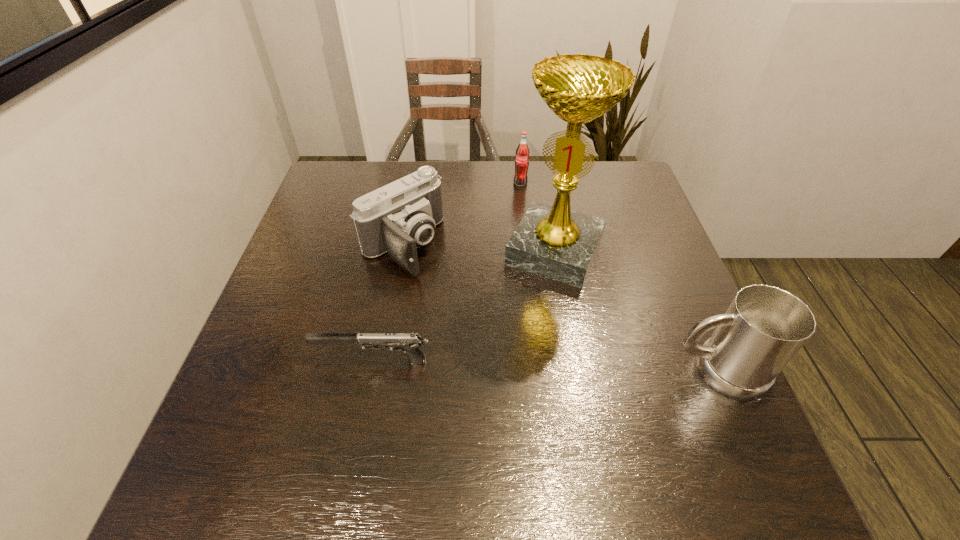
The width and height of the screenshot is (960, 540). In order to click on the shortest object in this screenshot , I will do `click(409, 343)`.

The width and height of the screenshot is (960, 540). What are the coordinates of `mug` in the screenshot? It's located at (764, 327).

You are a GUI agent. You are given a task and a screenshot of the screen. Output one action in this format:
    pyautogui.click(x=<x>, y=<y>)
    Task: Click on the farthest object
    Image resolution: width=960 pixels, height=540 pixels.
    Given the screenshot: What is the action you would take?
    pyautogui.click(x=522, y=152)

At what (x,y) coordinates should I click in order to perform the action: click on camera. Please return your answer as a coordinate pair (x, y). This screenshot has height=540, width=960. Looking at the image, I should click on (398, 218).

The width and height of the screenshot is (960, 540). I want to click on award, so click(554, 242).

Where is `free spot located at the muzzle end of the gun`? This screenshot has height=540, width=960. free spot located at the muzzle end of the gun is located at coordinates tap(268, 361).

I want to click on free location located 0.400m on the side of the rightmost object with the handle, so click(x=468, y=371).

Where is `blank space located on the side of the rightmost object with the handle`? This screenshot has width=960, height=540. blank space located on the side of the rightmost object with the handle is located at coordinates (523, 371).

Where is `vacant space located 0.120m on the side of the rightmost object with the handle`? This screenshot has height=540, width=960. vacant space located 0.120m on the side of the rightmost object with the handle is located at coordinates point(609,371).

Locate an element on the screen. vacant space positioned on the label of the soda bottle is located at coordinates (515, 252).